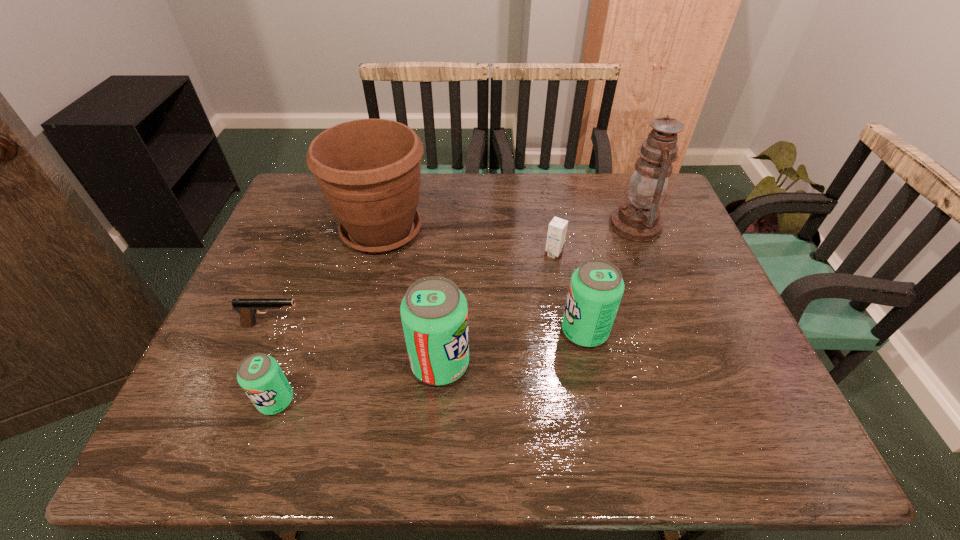
Where is `blank space located 0.190m on the front-facing side of the second tallest pop soda`? blank space located 0.190m on the front-facing side of the second tallest pop soda is located at coordinates (481, 331).

At what (x,y) coordinates should I click in order to perform the action: click on free space located on the front-facing side of the second tallest pop soda. Please return your answer as a coordinate pair (x, y). The image size is (960, 540). Looking at the image, I should click on (410, 331).

Find the location of a particular element. The height and width of the screenshot is (540, 960). vacant space located on the front-facing side of the second tallest pop soda is located at coordinates (472, 331).

What are the coordinates of `vacant space located on the right of the flowerpot` in the screenshot? It's located at (506, 231).

I want to click on free location located on the front of the chocolate milk, so click(x=558, y=279).

The width and height of the screenshot is (960, 540). In order to click on free space located 0.150m on the left of the tallest object in this screenshot , I will do `click(559, 225)`.

Find the location of `blank area located 0.140m at the muzzle of the shortest object`. blank area located 0.140m at the muzzle of the shortest object is located at coordinates (362, 324).

The height and width of the screenshot is (540, 960). I want to click on flowerpot that is positioned at the far edge, so pos(368,170).

This screenshot has height=540, width=960. Find the location of `oil lamp at the far edge`. oil lamp at the far edge is located at coordinates (637, 219).

Locate an element on the screen. This screenshot has width=960, height=540. pop soda located at the left edge is located at coordinates (260, 376).